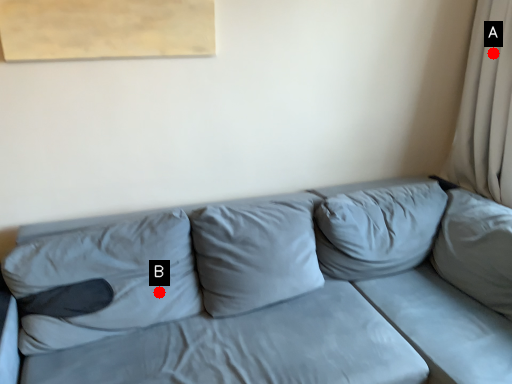
Question: Two points are circled on the image, labeled by A and B beside each circle. Which point is further to the camera?

Choices:
 (A) A is further
 (B) B is further

Answer: (A)